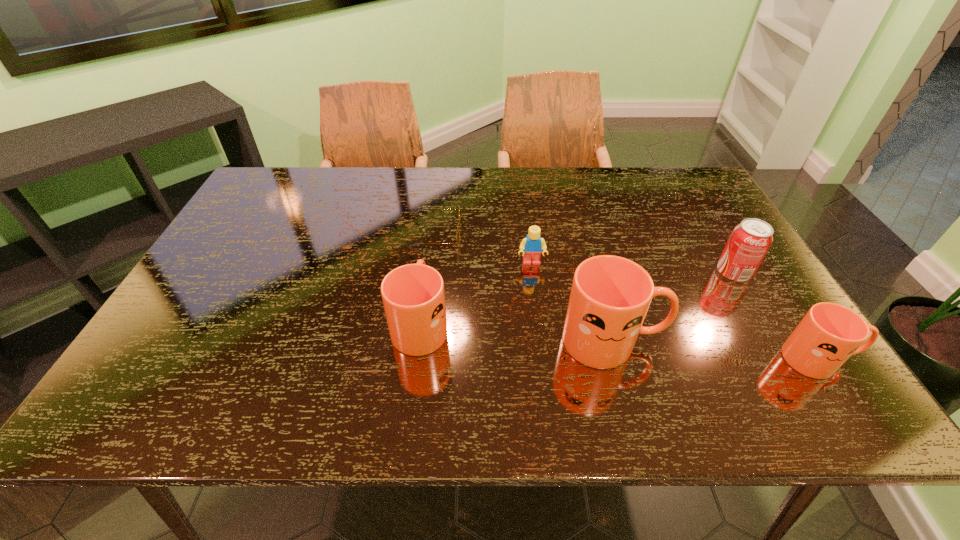
Locate an element on the screen. Image resolution: width=960 pixels, height=540 pixels. vacant region that satisfies the following two spatial constraints: 1. on the handle side of the second shortest mug; 2. on the left side of the soda is located at coordinates (427, 273).

The width and height of the screenshot is (960, 540). What are the coordinates of `free space that satisfies the following two spatial constraints: 1. on the handle side of the soda; 2. on the left side of the second tallest mug` in the screenshot? It's located at (427, 273).

Find the location of a particular element. This screenshot has width=960, height=540. vacant space that satisfies the following two spatial constraints: 1. on the handle side of the second shortest mug; 2. on the left side of the soda is located at coordinates click(427, 273).